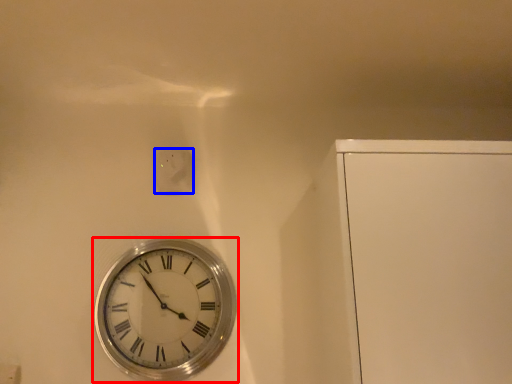
Question: Among these objects, which one is farthest to the camera, wall clock (highlighted by a red box) or electric outlet (highlighted by a blue box)?

Choices:
 (A) wall clock
 (B) electric outlet

Answer: (B)